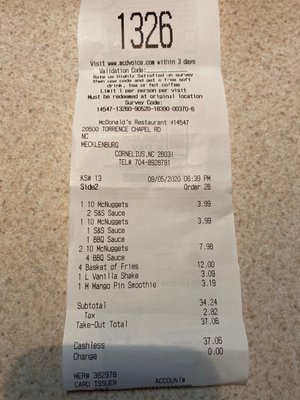
In order to click on empty counter to the right of reciept in this screenshot , I will do `click(256, 120)`.